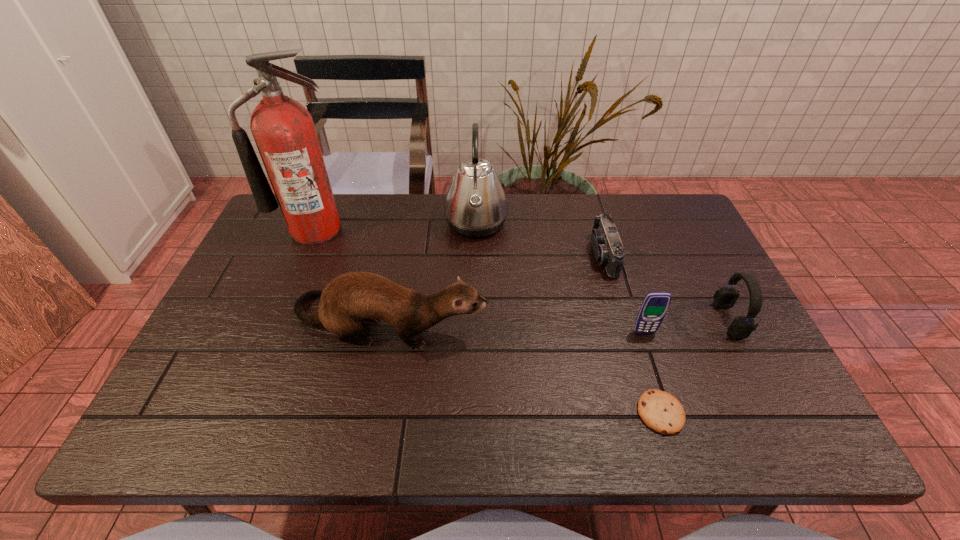
You are a GUI agent. You are given a task and a screenshot of the screen. Output one action in this format:
    pyautogui.click(x=<x>, y=<y>)
    Task: Click on the kettle that is at the far edge
    The width and height of the screenshot is (960, 540).
    Given the screenshot: What is the action you would take?
    pyautogui.click(x=475, y=206)

This screenshot has width=960, height=540. What are the coordinates of `camcorder that is at the far edge` in the screenshot? It's located at (606, 243).

What are the coordinates of `object present at the near edge` in the screenshot? It's located at (662, 412).

Locate an element on the screen. This screenshot has width=960, height=540. object that is at the left edge is located at coordinates 283,129.

The image size is (960, 540). Identify the location of object present at the right edge. (741, 327).

Find the location of a particular element. object that is at the far left corner is located at coordinates (283, 129).

You are a GUI agent. You are given a task and a screenshot of the screen. Output one action in this format:
    pyautogui.click(x=<x>, y=<y>)
    Task: Click on the free space at the far edge
    This screenshot has height=540, width=960.
    Given the screenshot: What is the action you would take?
    [635, 233]

Find the location of a particular element. vacant space at the near edge of the desktop is located at coordinates (470, 429).

Image resolution: width=960 pixels, height=540 pixels. I want to click on free spot at the left edge of the desktop, so click(x=262, y=302).

What are the coordinates of `vacant area at the right edge` in the screenshot? It's located at (735, 355).